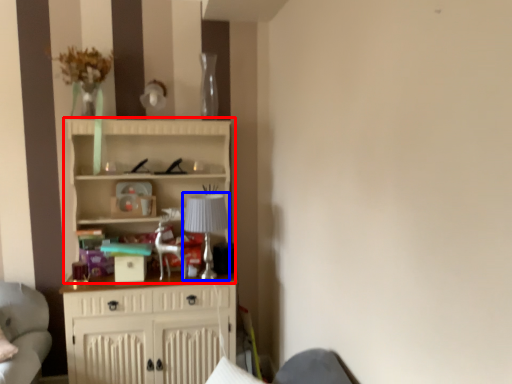
Question: Which point is further to the camera, cupboard (highlighted by a red box) or lamp (highlighted by a blue box)?

Choices:
 (A) cupboard
 (B) lamp

Answer: (B)